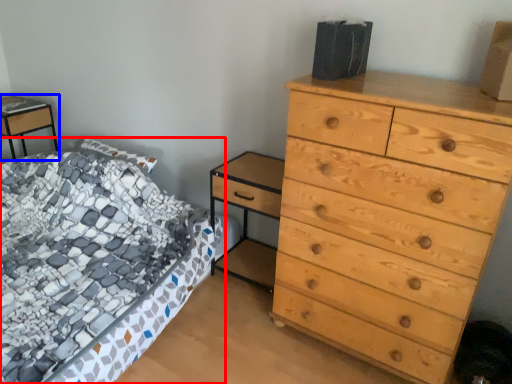
Question: Among these objects, which one is farthest to the camera, bed (highlighted by a red box) or nightstand (highlighted by a blue box)?

Choices:
 (A) bed
 (B) nightstand

Answer: (B)